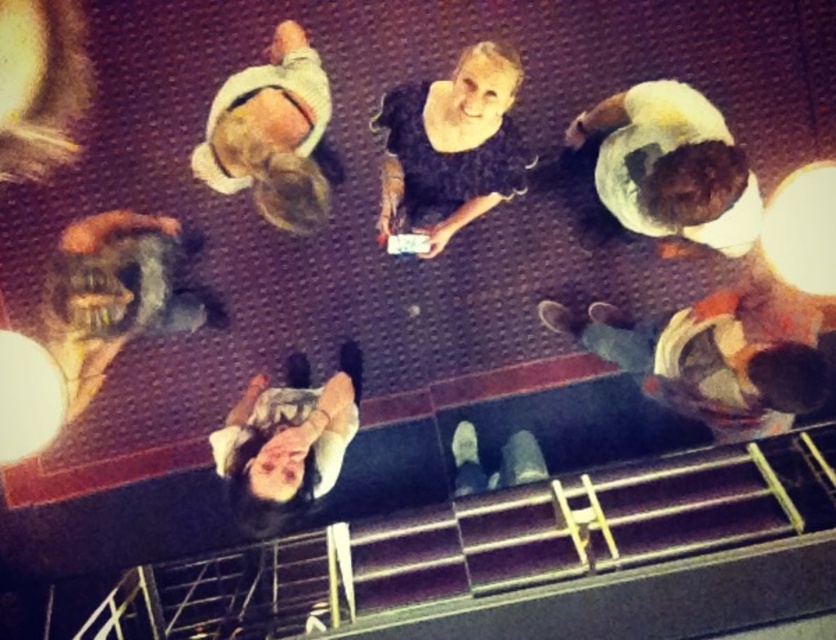
Question: Does smooth black stairs at lower center lie in front of white cotton shirt at upper left?

Choices:
 (A) yes
 (B) no

Answer: (B)

Question: Does white cotton shirt at upper left have a lesser width compared to smooth white shirt at lower center?

Choices:
 (A) yes
 (B) no

Answer: (B)

Question: Which object is positioned closest to the white cotton shirt at upper left?

Choices:
 (A) white cotton shirt at upper right
 (B) orange fabric shirt at right
 (C) shiny metallic helmet at left

Answer: (C)

Question: In this image, where is white cotton shirt at upper right located relative to denim jeans at lower center?

Choices:
 (A) below
 (B) above

Answer: (B)

Question: Which of these objects is positioned closest to the smooth white shirt at lower center?

Choices:
 (A) shiny metallic helmet at left
 (B) denim jeans at lower center

Answer: (A)

Question: Which object appears closest to the camera in this image?

Choices:
 (A) denim jeans at lower center
 (B) white cotton shirt at upper left

Answer: (B)